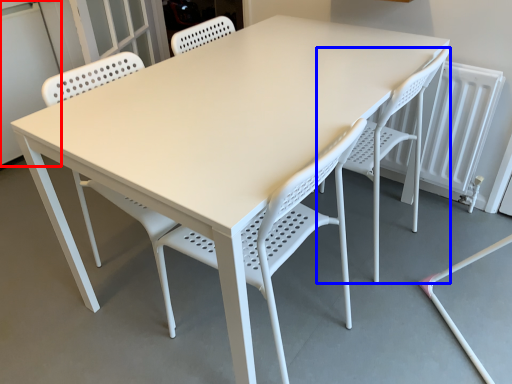
Question: Which of the following is the closest to the observer, screen door (highlighted by a red box) or chair (highlighted by a blue box)?

Choices:
 (A) screen door
 (B) chair

Answer: (B)